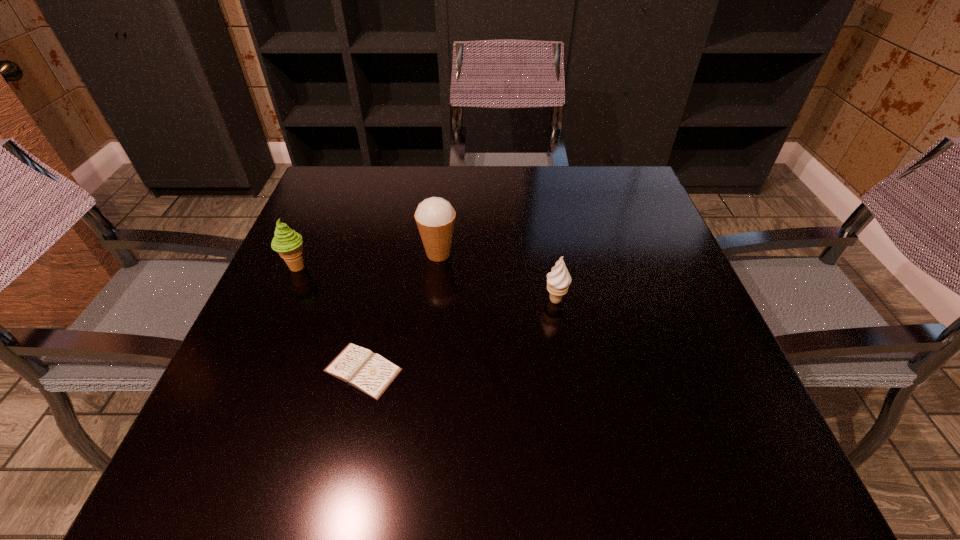
I want to click on the second icecream from left to right, so click(435, 216).

This screenshot has height=540, width=960. What are the coordinates of `the leftmost icecream` in the screenshot? It's located at (288, 243).

Where is `the rightmost icecream`? The image size is (960, 540). the rightmost icecream is located at coordinates (558, 280).

Where is `the rightmost object`? This screenshot has height=540, width=960. the rightmost object is located at coordinates (558, 280).

Identify the location of the nearest object. This screenshot has height=540, width=960. (359, 367).

Locate an element on the screen. This screenshot has height=540, width=960. diary is located at coordinates (359, 367).

You are a GUI agent. You are given a task and a screenshot of the screen. Output one action in this format:
    pyautogui.click(x=<x>, y=<y>)
    Task: Click on the free space located on the right of the second icecream from left to right
    This screenshot has width=960, height=540.
    Given the screenshot: What is the action you would take?
    pyautogui.click(x=595, y=254)

Where is `vacant space located on the right of the leftmost icecream`? This screenshot has width=960, height=540. vacant space located on the right of the leftmost icecream is located at coordinates (445, 267).

At what (x,y) coordinates should I click in order to perform the action: click on vacant space located 0.240m on the front-facing side of the second nearest object. Please return your answer as a coordinate pair (x, y). Image resolution: width=960 pixels, height=540 pixels. Looking at the image, I should click on (575, 417).

Find the location of a particular element. Image resolution: width=960 pixels, height=540 pixels. free space located 0.320m on the back of the diary is located at coordinates (393, 237).